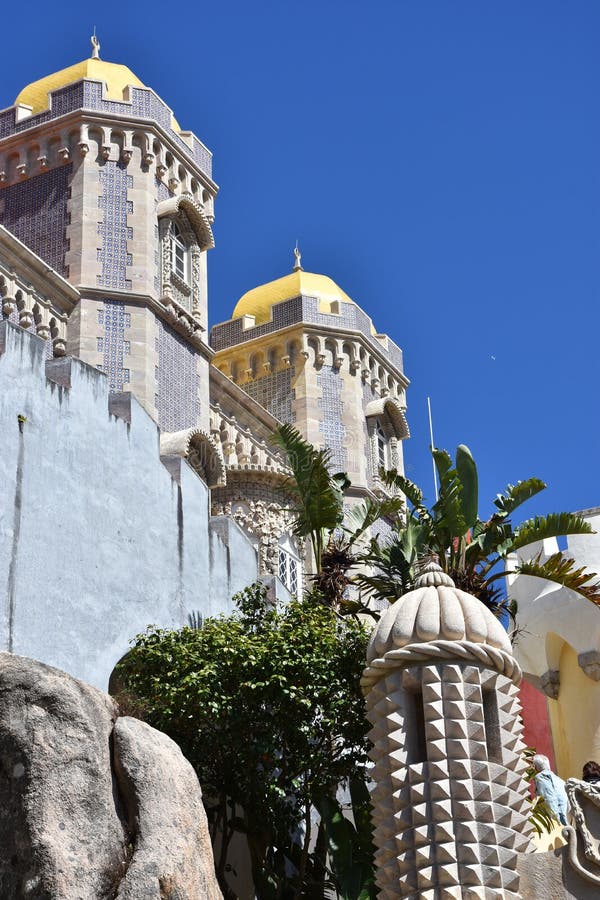
This screenshot has height=900, width=600. What are the coordinates of `window` in the screenshot? It's located at (381, 446), (178, 265).